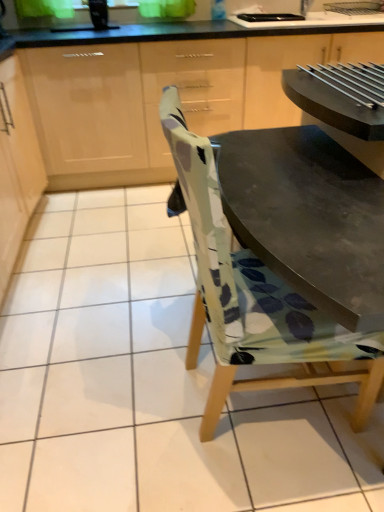
Question: From a real-world perspective, is printed fabric chair at center located beneath light wood cabinet at upper left, arranged as the 2th cabinetry when viewed from the right?

Choices:
 (A) yes
 (B) no

Answer: (B)

Question: From the image's perspective, is printed fabric chair at center beneath light wood cabinet at upper left, the 1th cabinetry positioned from the left?

Choices:
 (A) no
 (B) yes

Answer: (B)

Question: Does printed fabric chair at center appear on the left side of light wood cabinet at upper left, arranged as the 2th cabinetry when viewed from the right?

Choices:
 (A) yes
 (B) no

Answer: (B)

Question: From a real-world perspective, is printed fabric chair at center located higher than light wood cabinet at upper left, the 1th cabinetry positioned from the left?

Choices:
 (A) yes
 (B) no

Answer: (A)

Question: From the image's perspective, is printed fabric chair at center located above light wood cabinet at upper left, the 1th cabinetry positioned from the left?

Choices:
 (A) yes
 (B) no

Answer: (B)

Question: Could you tell me if printed fabric chair at center is turned towards light wood cabinet at upper left, arranged as the 2th cabinetry when viewed from the right?

Choices:
 (A) yes
 (B) no

Answer: (B)

Question: From a real-world perspective, is matte wood cabinets at upper center, placed as the 2th cabinetry when sorted from left to right, beneath printed fabric chair at center?

Choices:
 (A) yes
 (B) no

Answer: (A)

Question: From a real-world perspective, does matte wood cabinets at upper center, placed as the 2th cabinetry when sorted from left to right, stand above printed fabric chair at center?

Choices:
 (A) yes
 (B) no

Answer: (B)

Question: From the image's perspective, is matte wood cabinets at upper center, placed as the 2th cabinetry when sorted from left to right, beneath printed fabric chair at center?

Choices:
 (A) no
 (B) yes

Answer: (A)

Question: Considering the relative sizes of matte wood cabinets at upper center, placed as the 2th cabinetry when sorted from left to right, and printed fabric chair at center in the image provided, is matte wood cabinets at upper center, placed as the 2th cabinetry when sorted from left to right, bigger than printed fabric chair at center?

Choices:
 (A) yes
 (B) no

Answer: (A)

Question: Considering the relative positions of matte wood cabinets at upper center, placed as the 2th cabinetry when sorted from left to right, and printed fabric chair at center in the image provided, is matte wood cabinets at upper center, placed as the 2th cabinetry when sorted from left to right, in front of printed fabric chair at center?

Choices:
 (A) no
 (B) yes

Answer: (A)

Question: Could you tell me if matte wood cabinets at upper center, placed as the 2th cabinetry when sorted from left to right, is turned towards printed fabric chair at center?

Choices:
 (A) yes
 (B) no

Answer: (A)

Question: Is matte wood cabinets at upper center, placed as the 2th cabinetry when sorted from left to right, positioned in front of light wood cabinet at upper left, arranged as the 2th cabinetry when viewed from the right?

Choices:
 (A) yes
 (B) no

Answer: (B)